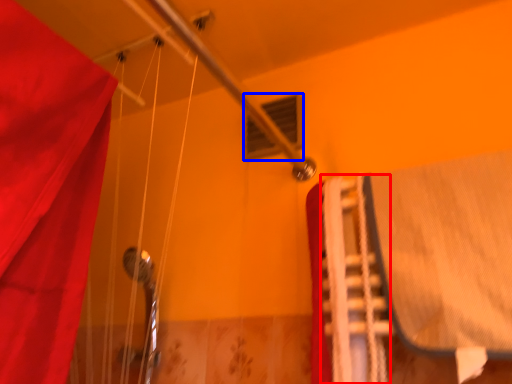
Question: Among these objects, which one is nearest to the camera, stair (highlighted by a red box) or window (highlighted by a blue box)?

Choices:
 (A) stair
 (B) window

Answer: (A)